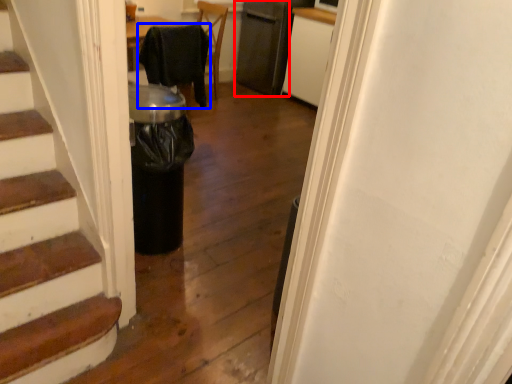
Question: Which of the following is the closest to the observer, appliance (highlighted by a red box) or chair (highlighted by a blue box)?

Choices:
 (A) appliance
 (B) chair

Answer: (B)